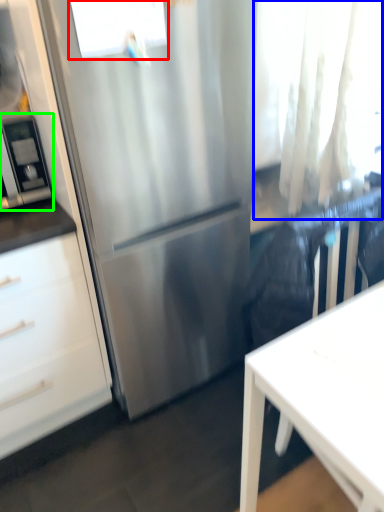
Question: Estimate the real-world distances between objects in this image. Which object is closer to window (highlighted by a red box), curtain (highlighted by a blue box) or appliance (highlighted by a green box)?

Choices:
 (A) curtain
 (B) appliance

Answer: (B)